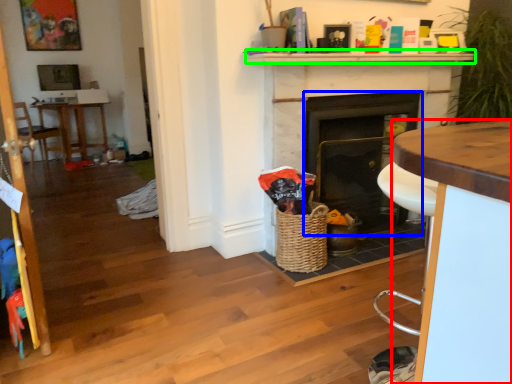
Question: Estimate the real-world distances between objects in this image. Which object is closer to desk (highlighted by a red box), fireplace (highlighted by a blue box) or mantle (highlighted by a green box)?

Choices:
 (A) fireplace
 (B) mantle

Answer: (B)